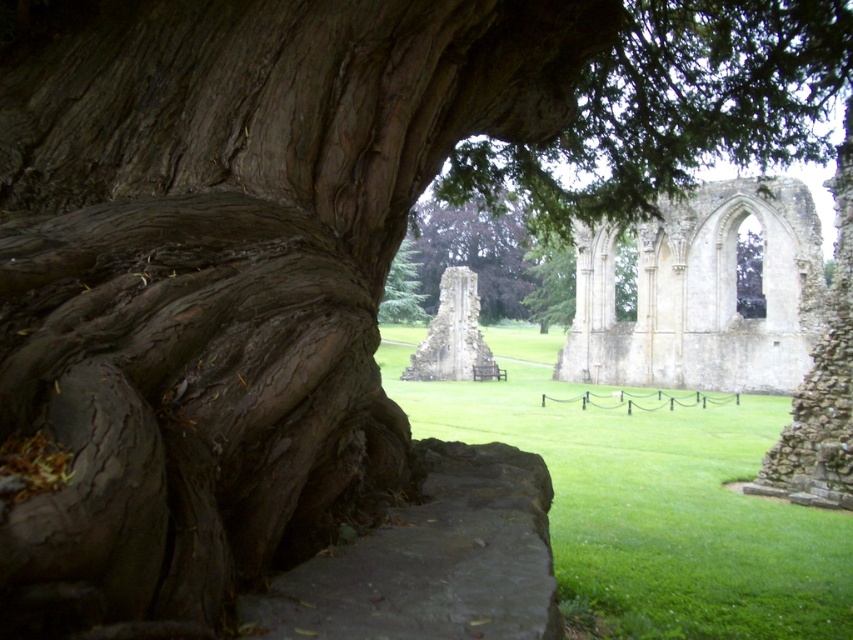
Is white stone ruins at center positioned behind green textured tree at center?

Yes, it is.

Which is behind, point (733, 232) or point (422, 317)?

Positioned behind is point (422, 317).

You are a GUI agent. You are given a task and a screenshot of the screen. Output one action in this format:
    pyautogui.click(x=<x>, y=<y>)
    Task: Click on the white stone ruins at center
    Image resolution: width=853 pixels, height=640 pixels.
    Given the screenshot: What is the action you would take?
    pyautogui.click(x=701, y=296)

Can you confirm if green leafy tree at center is positioned above green textured tree at center?

Indeed, green leafy tree at center is positioned over green textured tree at center.

Who is higher up, green leafy tree at center or green textured tree at center?

Positioned higher is green leafy tree at center.

The image size is (853, 640). Describe the element at coordinates (473, 253) in the screenshot. I see `green leafy tree at center` at that location.

Locate an element on the screen. The image size is (853, 640). green leafy tree at center is located at coordinates (473, 253).

Is brown rough bark at left in front of white stone ruins at center?

Yes.

Is point (328, 381) closer to viewer compared to point (677, 227)?

Yes.

Is point (421, 61) less distant than point (672, 355)?

That is True.

This screenshot has width=853, height=640. I want to click on brown rough bark at left, so click(223, 273).